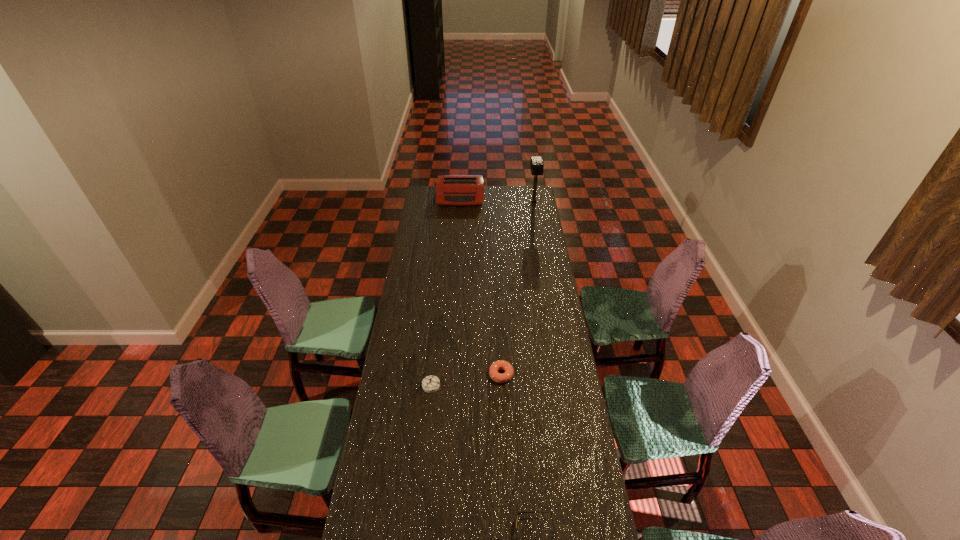
I want to click on vacant space that's between the fourth tallest object and the tallest object, so [x=517, y=288].

The width and height of the screenshot is (960, 540). Identify the location of vacant space that's between the fourth shortest object and the third tallest object. (445, 291).

The image size is (960, 540). What are the coordinates of `vacant space that is in between the rightmost object and the doughnut` in the screenshot? It's located at (517, 288).

I want to click on free space that is in between the fourth tallest object and the compass, so click(466, 380).

In order to click on free space between the third tallest object and the second shortest object in this screenshot , I will do `click(466, 380)`.

Where is `object that is the third closest to the second shortest object`? This screenshot has height=540, width=960. object that is the third closest to the second shortest object is located at coordinates (457, 190).

Where is `object that ranks as the third closest to the compass`? This screenshot has width=960, height=540. object that ranks as the third closest to the compass is located at coordinates (457, 190).

Identify the location of vacant area that satisfies the following two spatial constraints: 1. on the typing side of the doughnut; 2. on the right side of the second tallest object. (448, 375).

Where is `free space that satisfies the following two spatial constraints: 1. on the typing side of the tallest object; 2. on the right side of the fourth shortest object`? This screenshot has width=960, height=540. free space that satisfies the following two spatial constraints: 1. on the typing side of the tallest object; 2. on the right side of the fourth shortest object is located at coordinates (460, 202).

In order to click on vacant region that satisfies the following two spatial constraints: 1. on the typing side of the mallet; 2. on the right side of the typewriter in this screenshot , I will do `click(460, 202)`.